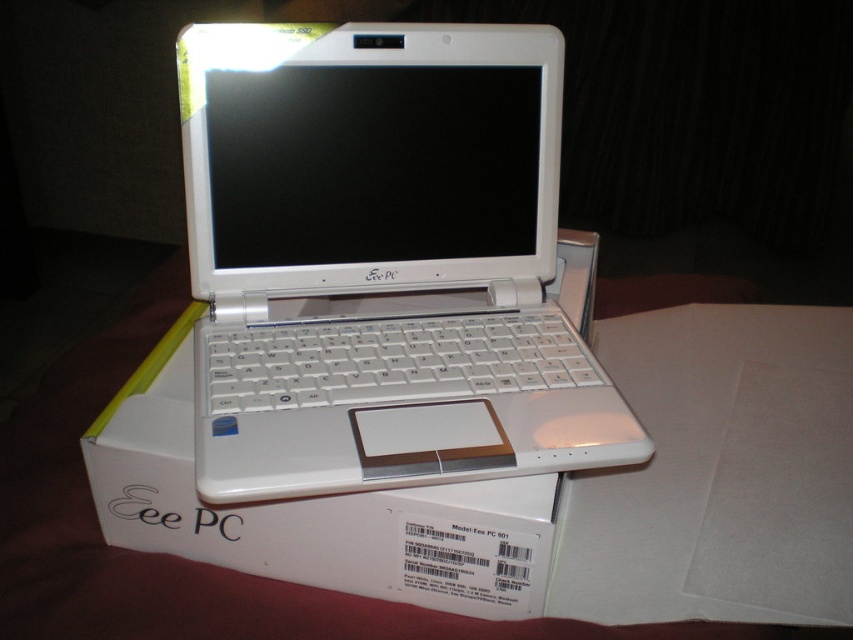
Does white glossy laptop at center appear over white cardboard box at center?

Yes, white glossy laptop at center is above white cardboard box at center.

Is white glossy laptop at center taller than white cardboard box at center?

Indeed, white glossy laptop at center has a greater height compared to white cardboard box at center.

Which is in front, point (476, 358) or point (357, 508)?

Positioned in front is point (357, 508).

Locate an element on the screen. white glossy laptop at center is located at coordinates (381, 260).